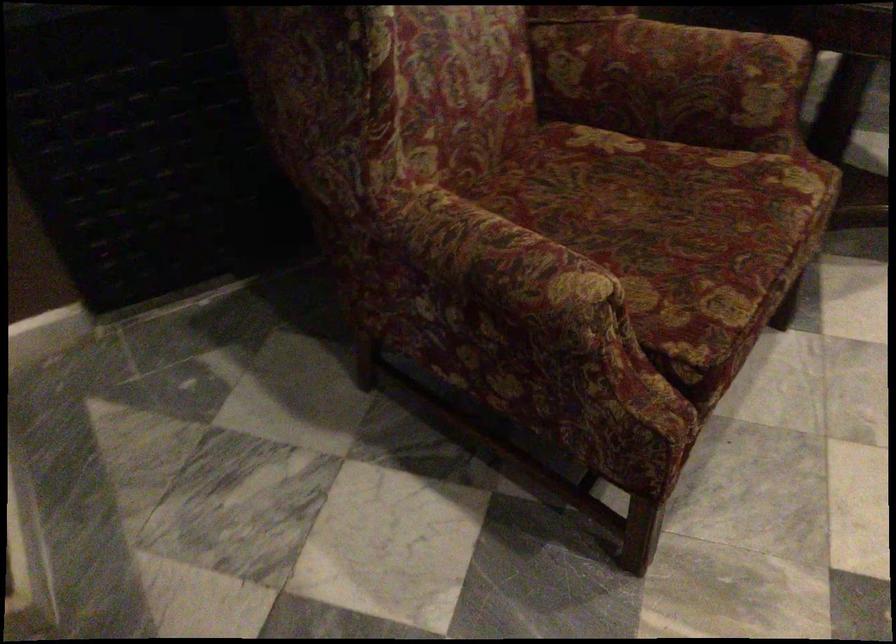
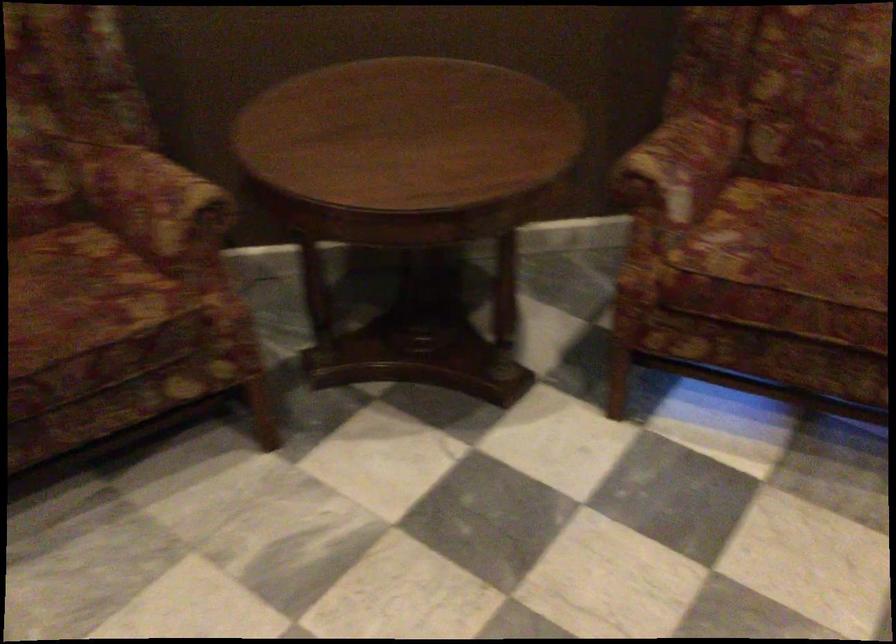
Where in the second image is the point corresponding to the point at 725,71 from the first image?

(156, 204)